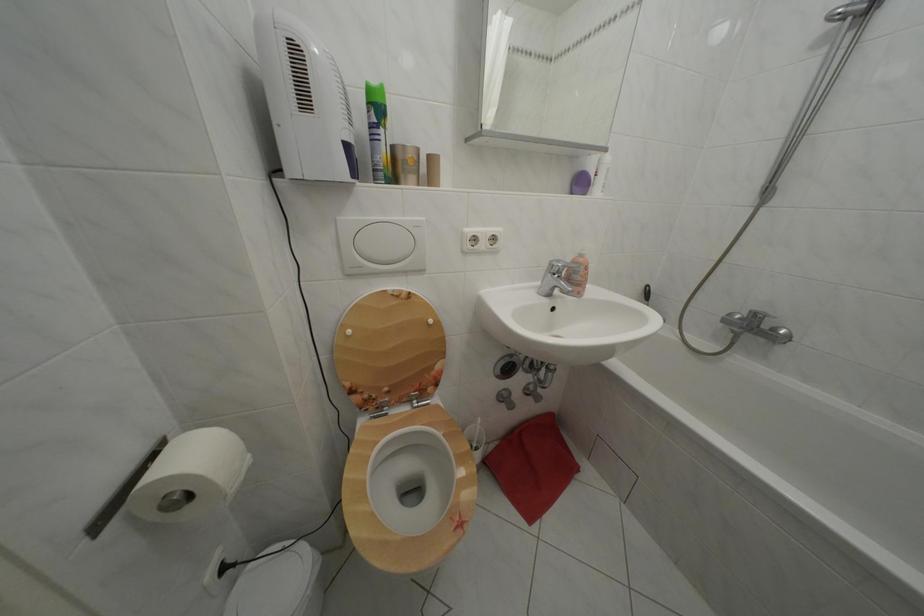
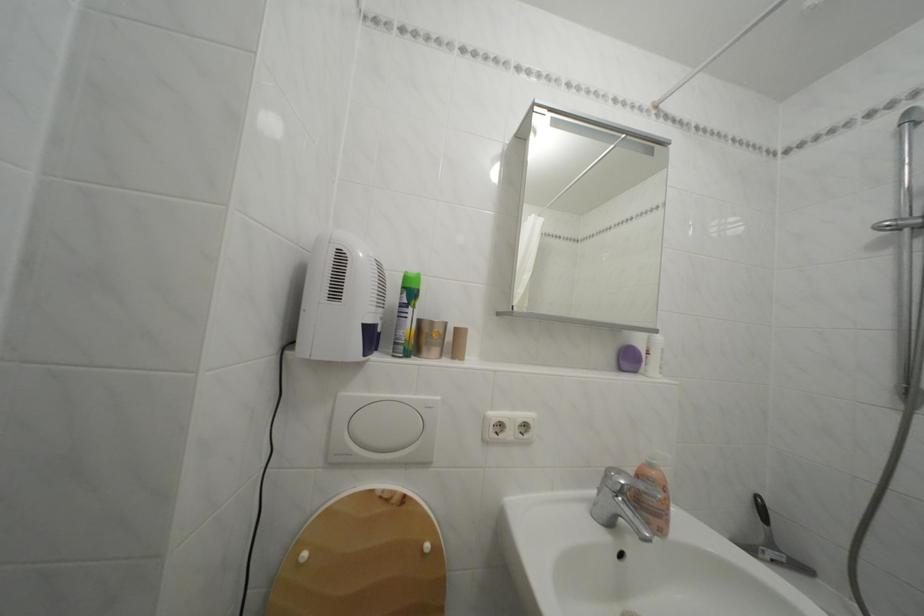
Question: The images are taken continuously from a first-person perspective. In which direction are you moving?

Choices:
 (A) Left
 (B) Right
 (C) Forward
 (D) Backward

Answer: (C)